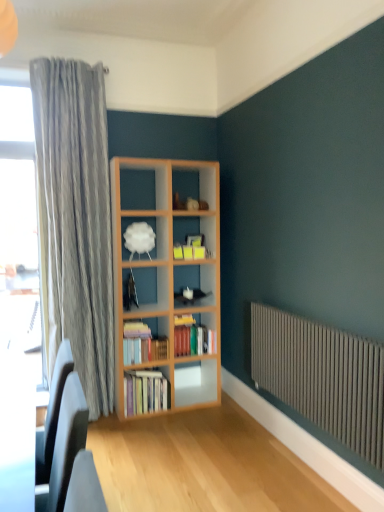
Question: Considering the relative sizes of matte black swivel chair at lower left and hardcover books at center, the 3th book viewed from the top, in the image provided, is matte black swivel chair at lower left bigger than hardcover books at center, the 3th book viewed from the top,?

Choices:
 (A) no
 (B) yes

Answer: (B)

Question: Can you confirm if matte black swivel chair at lower left is thinner than hardcover books at center, which is counted as the first book, starting from the bottom?

Choices:
 (A) yes
 (B) no

Answer: (B)

Question: Does matte black swivel chair at lower left appear on the right side of hardcover books at center, which is counted as the first book, starting from the bottom?

Choices:
 (A) no
 (B) yes

Answer: (A)

Question: Is matte black swivel chair at lower left wider than hardcover books at center, which is counted as the first book, starting from the bottom?

Choices:
 (A) no
 (B) yes

Answer: (B)

Question: From the image's perspective, is matte black swivel chair at lower left on hardcover books at center, the 3th book viewed from the top?

Choices:
 (A) no
 (B) yes

Answer: (B)

Question: Considering the positions of hardcover books at center, the 1th book from the top, and matte black swivel chair at lower left in the image, is hardcover books at center, the 1th book from the top, bigger or smaller than matte black swivel chair at lower left?

Choices:
 (A) small
 (B) big

Answer: (A)

Question: In terms of width, does hardcover books at center, the 1th book from the top, look wider or thinner when compared to matte black swivel chair at lower left?

Choices:
 (A) wide
 (B) thin

Answer: (A)

Question: Visually, is hardcover books at center, the 1th book from the top, positioned to the left or to the right of matte black swivel chair at lower left?

Choices:
 (A) left
 (B) right

Answer: (B)

Question: In the image, is hardcover books at center, the 1th book from the top, positioned in front of or behind matte black swivel chair at lower left?

Choices:
 (A) front
 (B) behind

Answer: (B)

Question: In the image, is gray metallic radiator at lower right on the left side or the right side of hardcover books at center, the third book positioned from the bottom?

Choices:
 (A) left
 (B) right

Answer: (B)

Question: From a real-world perspective, relative to hardcover books at center, the 1th book from the top, is gray metallic radiator at lower right vertically above or below?

Choices:
 (A) below
 (B) above

Answer: (A)

Question: Considering the positions of point [x=324, y=415] and point [x=185, y=345], is point [x=324, y=415] closer or farther from the camera than point [x=185, y=345]?

Choices:
 (A) farther
 (B) closer

Answer: (B)

Question: From the image's perspective, is gray metallic radiator at lower right located above or below hardcover books at center, the 1th book from the top?

Choices:
 (A) below
 (B) above

Answer: (A)

Question: From the image's perspective, is white matte cloud at center positioned above or below hardcover books at center, the 1th book from the top?

Choices:
 (A) below
 (B) above

Answer: (B)

Question: From a real-world perspective, is white matte cloud at center positioned above or below hardcover books at center, the third book positioned from the bottom?

Choices:
 (A) above
 (B) below

Answer: (A)